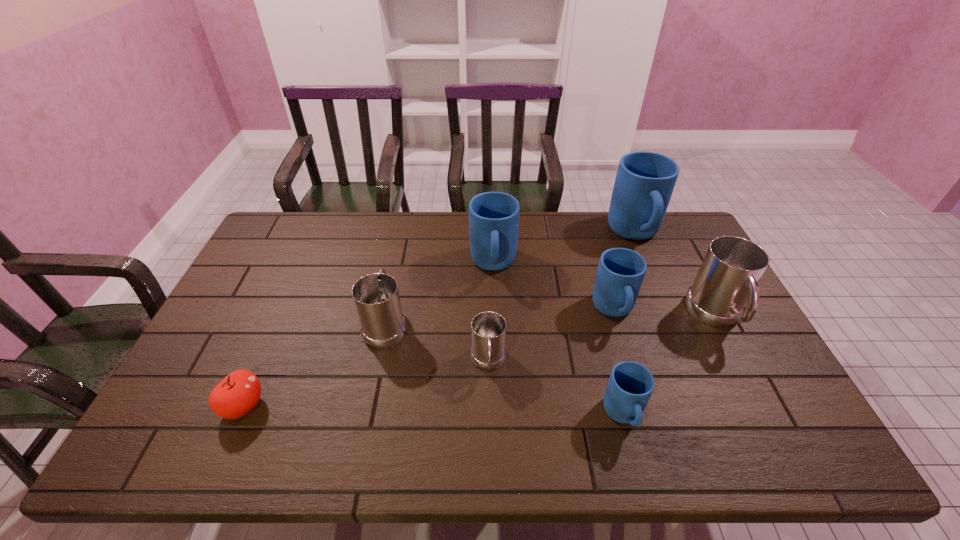
I want to click on free space at the far left corner, so click(270, 241).

Where is `vacant space at the near left corner of the desktop`? vacant space at the near left corner of the desktop is located at coordinates (149, 449).

The image size is (960, 540). Find the location of `free space at the near right corner of the desktop`. free space at the near right corner of the desktop is located at coordinates (746, 452).

Find the location of a particular element. Image resolution: width=960 pixels, height=540 pixels. vacant area that lies between the tallest mug and the biggest gray mug is located at coordinates (675, 275).

Identify the location of free space between the red apple and the third farthest blue mug. (429, 359).

I want to click on empty space that is in between the tallest mug and the biggest gray mug, so click(675, 275).

The height and width of the screenshot is (540, 960). I want to click on vacant area that lies between the nearest mug and the red apple, so [x=433, y=411].

The image size is (960, 540). Find the location of `free area in between the smallest gray mug and the second smallest gray mug`. free area in between the smallest gray mug and the second smallest gray mug is located at coordinates (437, 343).

You are a GUI agent. You are given a task and a screenshot of the screen. Output one action in this format:
    pyautogui.click(x=<x>, y=<y>)
    Task: Click on the vacant area that lies between the second gray mug from left to right and the apple
    
    Given the screenshot: What is the action you would take?
    pyautogui.click(x=366, y=384)

The height and width of the screenshot is (540, 960). In order to click on free space between the third smallest blue mug and the nearest blue mug in this screenshot , I will do `click(558, 340)`.